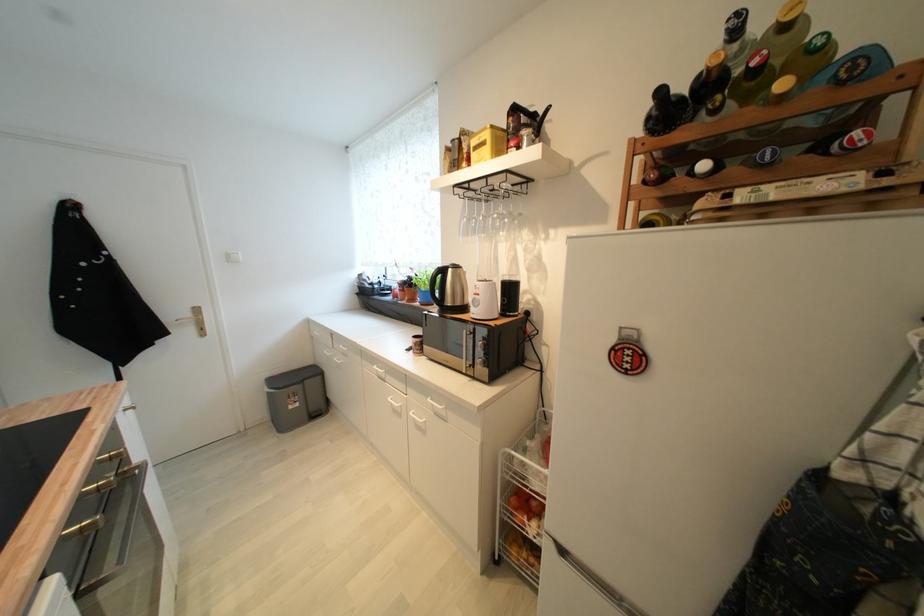
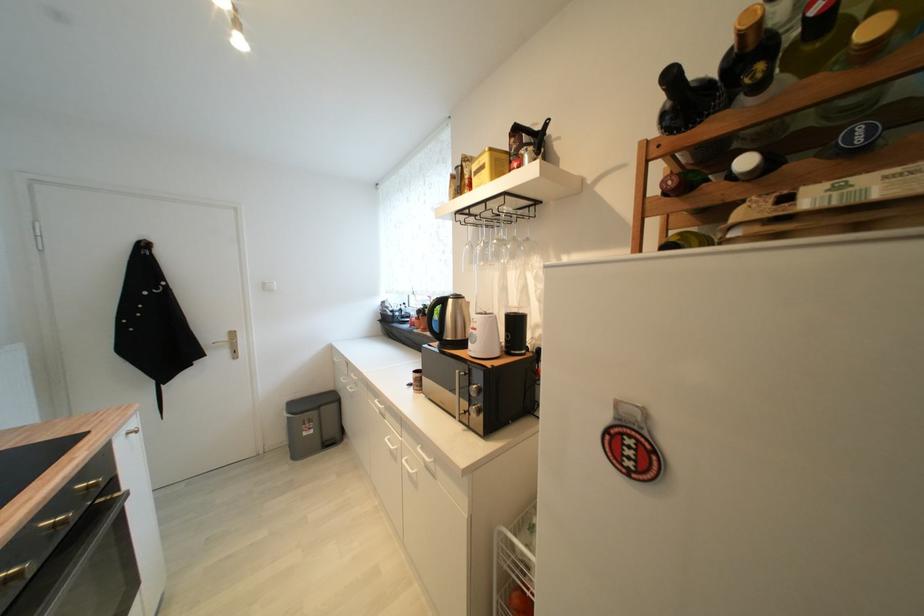
Find the pixel in the second image that matches (x=488, y=214) in the first image.

(489, 240)